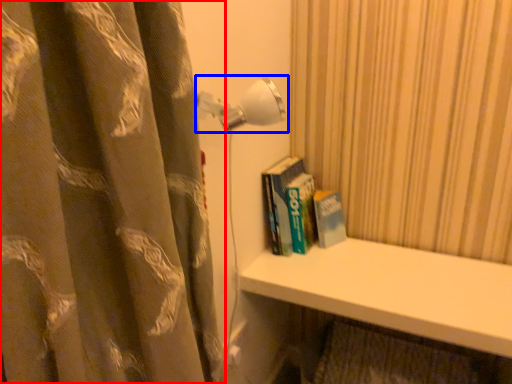
Question: Which object is closer to the camera taking this photo, curtain (highlighted by a red box) or lamp (highlighted by a blue box)?

Choices:
 (A) curtain
 (B) lamp

Answer: (A)